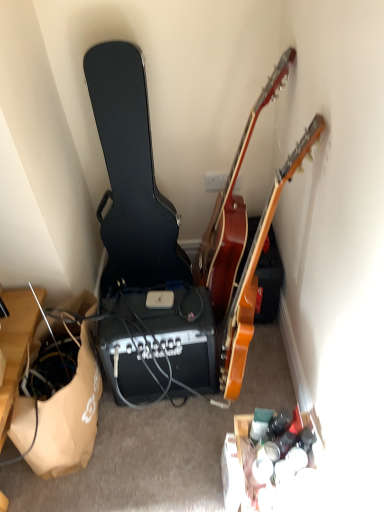
Question: Relative to black plastic speaker at center, is brown paper bag at lower left in front or behind?

Choices:
 (A) behind
 (B) front

Answer: (B)

Question: From the image's perspective, is brown paper bag at lower left positioned above or below black plastic speaker at center?

Choices:
 (A) above
 (B) below

Answer: (B)

Question: Estimate the real-world distances between objects in this image. Which object is farther from the brown paper bag at lower left?

Choices:
 (A) glossy wood guitar at upper right, acting as the second guitar starting from the right
 (B) black hard case at left, which is the first guitar in left-to-right order
 (C) wooden acoustic guitar at upper right, which ranks as the 1th guitar in right-to-left order
 (D) black plastic speaker at center

Answer: (A)

Question: Which of these objects is positioned farthest from the glossy wood guitar at upper right, which is counted as the 2th guitar, starting from the left?

Choices:
 (A) brown paper bag at lower left
 (B) black plastic speaker at center
 (C) wooden acoustic guitar at upper right, the third guitar viewed from the left
 (D) black hard case at left, the 3th guitar viewed from the right

Answer: (A)